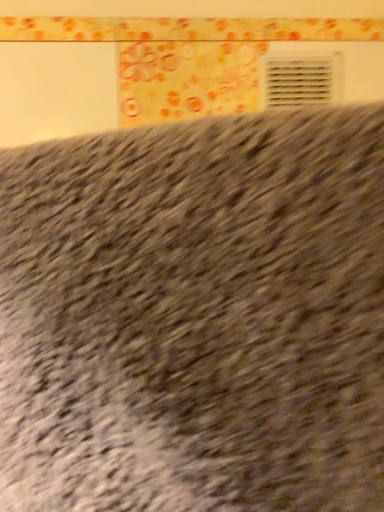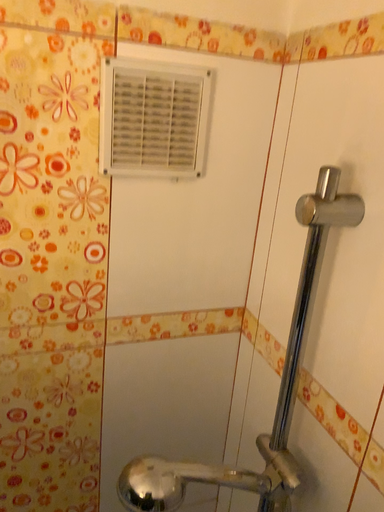
Question: Which way did the camera rotate in the video?

Choices:
 (A) rotated upward
 (B) rotated downward

Answer: (B)